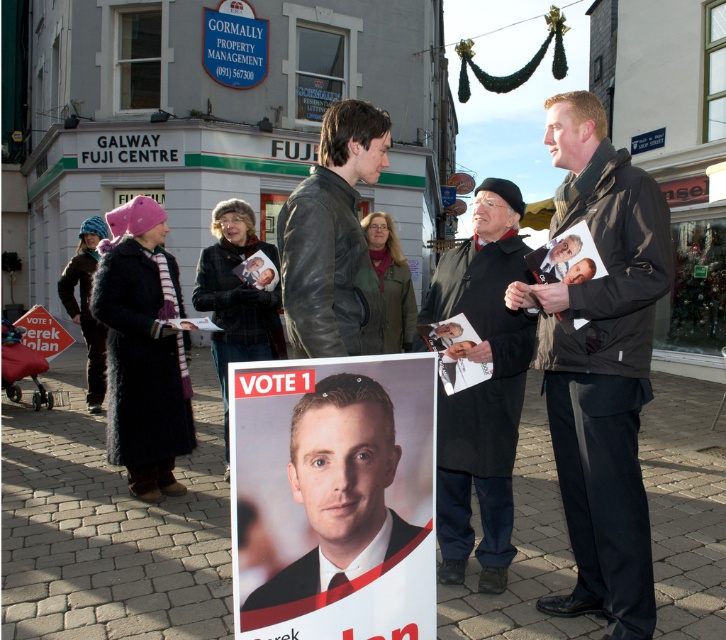
You are a photographer positioned at the center of the street. You want to capture a photo of the black leather jacket at center without including the VOTE 1 poster. Is the jacket positioned in a way that allows this?

The black leather jacket at center is located at point (x=237, y=298), which is directly in front of the photographer. Since the jacket is at the center and the photographer is also at the center, it would be challenging to avoid including the VOTE 1 poster in the frame. The photographer may need to adjust their position or angle to exclude the poster while focusing on the jacket.

You are a pedestrian walking down the street and see the black wool coat at center and the blue plastic sign at upper center. Which object is positioned higher up in the scene?

The blue plastic sign at upper center is positioned higher up in the scene than the black wool coat at center.

You are a photographer standing in the street scene. You want to take a photo of the leather jacket at center without including any other objects in the frame. Is the distance sufficient to do so?

The leather jacket at center is 2.23 meters away from viewer. Since there are no other objects mentioned in the scene that are closer than this distance, the photographer can move back slightly to ensure only the leather jacket is in the frame.